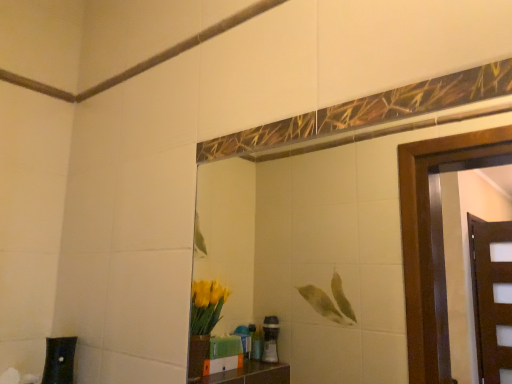
Where is `matte glass mirror at upper center`? Image resolution: width=512 pixels, height=384 pixels. matte glass mirror at upper center is located at coordinates (319, 244).

Describe the element at coordinates (319, 244) in the screenshot. I see `matte glass mirror at upper center` at that location.

Where is `matte glass mirror at upper center`? matte glass mirror at upper center is located at coordinates (319, 244).